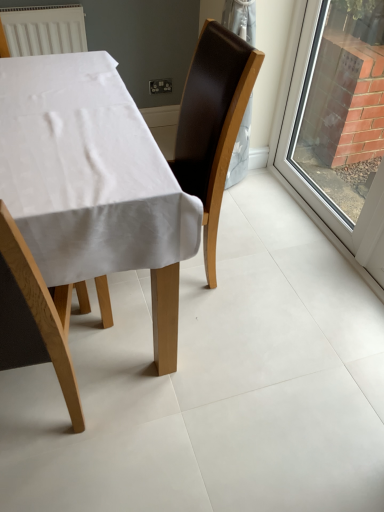
The width and height of the screenshot is (384, 512). What are the coordinates of `free space above white fabric-covered table at center (from a real-world perspective)` in the screenshot? It's located at (69, 112).